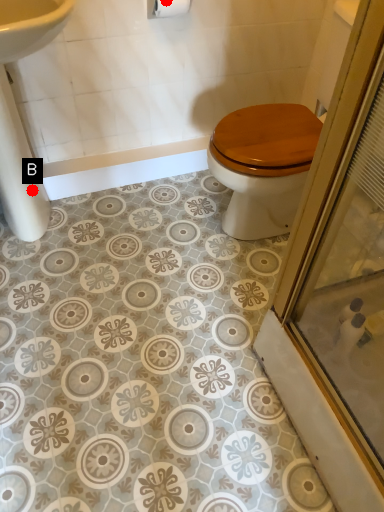
Question: Two points are circled on the image, labeled by A and B beside each circle. Which of the following is the closest to the observer?

Choices:
 (A) A is closer
 (B) B is closer

Answer: (A)